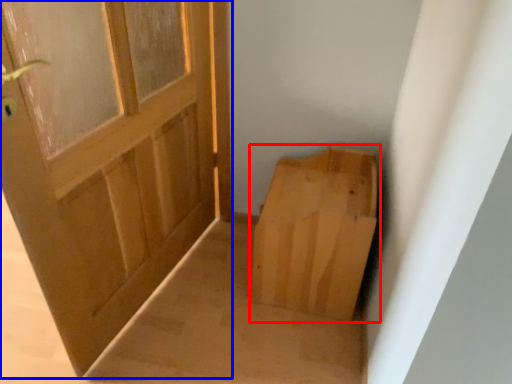
Question: Which object appears closest to the camera in this image, cardboard box (highlighted by a red box) or door (highlighted by a blue box)?

Choices:
 (A) cardboard box
 (B) door

Answer: (B)